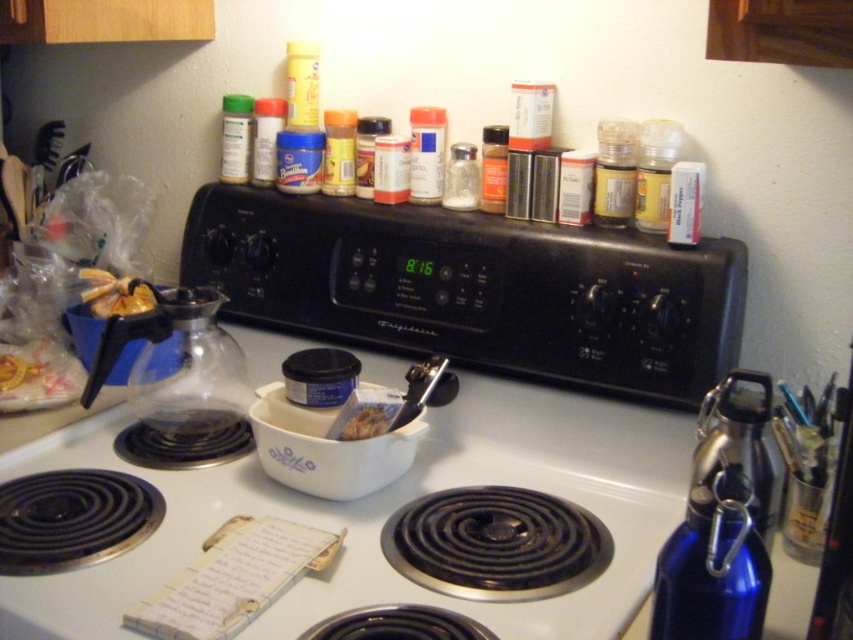
You are standing in the kitchen looking at the stove and the items on it. Which spice jar, the yellow matte spice jar at center or the matte plastic spice jar at upper center, is closer to you?

The yellow matte spice jar at center is closer to you because it is in front of the matte plastic spice jar at upper center.